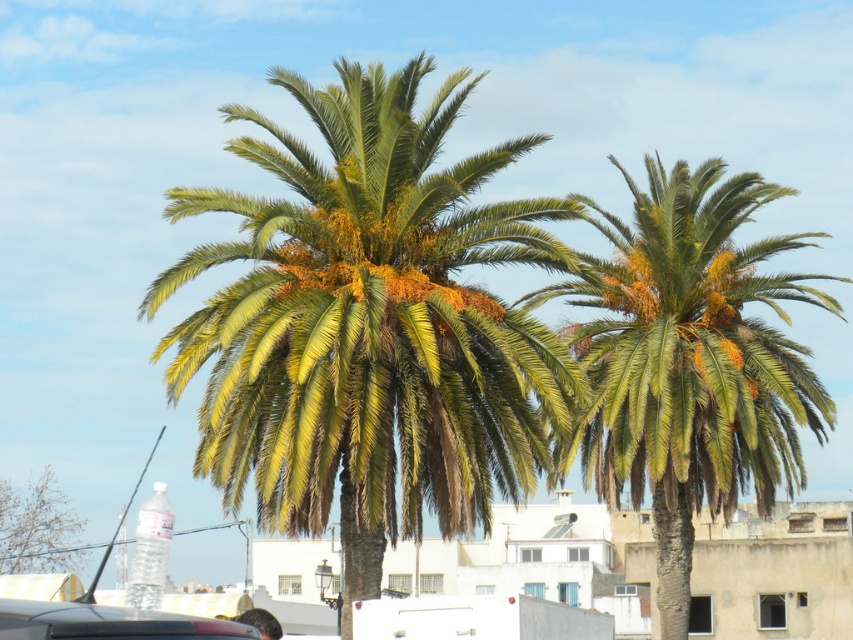
Question: Does green leafy palm at center have a lesser width compared to green leafy palm at lower left?

Choices:
 (A) no
 (B) yes

Answer: (A)

Question: Which object is positioned farthest from the green leafy palm at center?

Choices:
 (A) green leafy palm at right
 (B) matte black car at lower left

Answer: (B)

Question: Which point is farther to the camera?

Choices:
 (A) green leafy palm at right
 (B) matte black car at lower left
 (C) green leafy palm at lower left
 (D) green leafy palm at center

Answer: (C)

Question: Which point is closer to the camera?

Choices:
 (A) green leafy palm at right
 (B) green leafy palm at lower left

Answer: (A)

Question: Is green leafy palm at center below green leafy palm at right?

Choices:
 (A) yes
 (B) no

Answer: (B)

Question: Does green leafy palm at center come in front of green leafy palm at right?

Choices:
 (A) no
 (B) yes

Answer: (B)